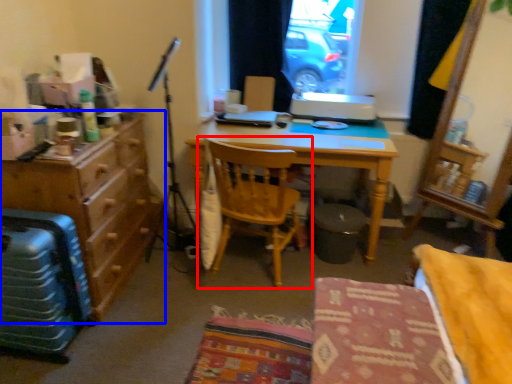
Question: Which point is further to the camera, chair (highlighted by a red box) or cabinetry (highlighted by a blue box)?

Choices:
 (A) chair
 (B) cabinetry

Answer: (A)